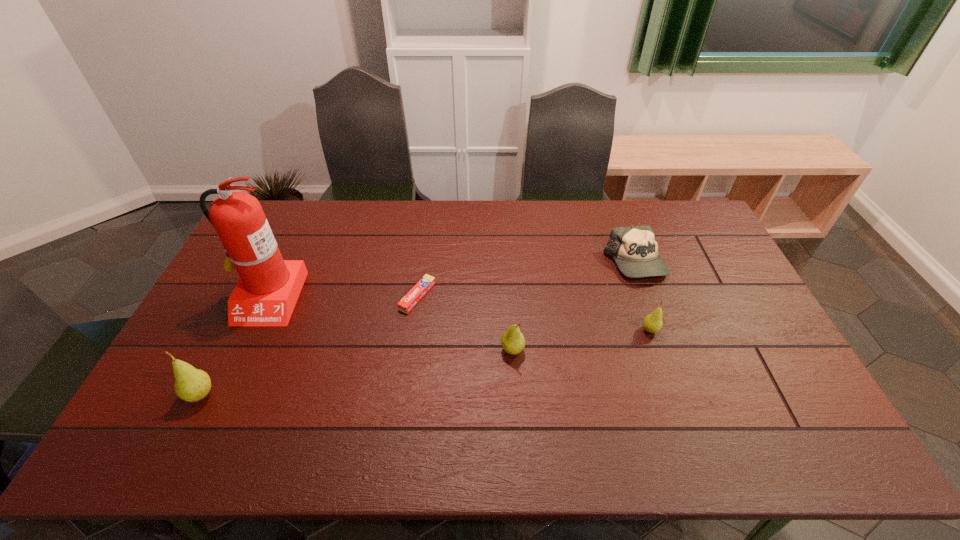
Find the location of `vacant space at the far edge of the desktop`. vacant space at the far edge of the desktop is located at coordinates 588,209.

At what (x,y) coordinates should I click in order to perform the action: click on vacant space at the near edge of the desktop. Please return your answer as a coordinate pair (x, y). Image resolution: width=960 pixels, height=540 pixels. Looking at the image, I should click on (606, 407).

In the image, there is a desktop. Find the location of `free space at the left edge`. free space at the left edge is located at coordinates (200, 329).

In the image, there is a desktop. Where is `free space at the right edge`? free space at the right edge is located at coordinates (693, 244).

In order to click on vacant space at the near right corner of the desktop in this screenshot , I will do point(755,388).

Where is `blank region between the tallest object and the third tallest object`? This screenshot has height=540, width=960. blank region between the tallest object and the third tallest object is located at coordinates (390, 324).

Where is `empty location between the farthest pear and the fifth farthest object`? This screenshot has height=540, width=960. empty location between the farthest pear and the fifth farthest object is located at coordinates (581, 340).

Where is `free space between the second shortest object and the third shortest object`? This screenshot has height=540, width=960. free space between the second shortest object and the third shortest object is located at coordinates (642, 296).

Locate an element on the screen. The width and height of the screenshot is (960, 540). free point between the fourth shortest object and the baseball cap is located at coordinates (573, 306).

Where is `empty space between the shortest object and the baseball cap`? The image size is (960, 540). empty space between the shortest object and the baseball cap is located at coordinates (526, 280).